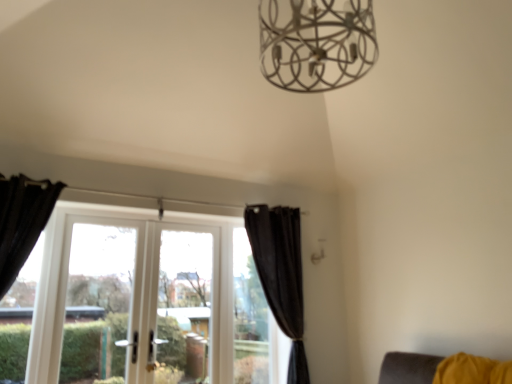
Question: Should I look upward or downward to see white glass screen door at left?

Choices:
 (A) down
 (B) up

Answer: (A)

Question: Does transparent glass window at center, the 1th window in the right-to-left sequence, appear on the right side of black velvet curtain at center, which appears as the 1th curtain when viewed from the back?

Choices:
 (A) no
 (B) yes

Answer: (A)

Question: From a real-world perspective, is transparent glass window at center, placed as the second window when sorted from left to right, under black velvet curtain at center, which ranks as the second curtain in left-to-right order?

Choices:
 (A) no
 (B) yes

Answer: (B)

Question: Is black velvet curtain at center, which is counted as the second curtain, starting from the front, a part of transparent glass window at center, placed as the second window when sorted from left to right?

Choices:
 (A) yes
 (B) no

Answer: (B)

Question: Can you confirm if transparent glass window at center, placed as the second window when sorted from left to right, is positioned to the left of black velvet curtain at center, which ranks as the second curtain in left-to-right order?

Choices:
 (A) yes
 (B) no

Answer: (A)

Question: From a real-world perspective, is transparent glass window at center, the 1th window in the right-to-left sequence, physically above black velvet curtain at center, which ranks as the second curtain in left-to-right order?

Choices:
 (A) yes
 (B) no

Answer: (B)

Question: Is transparent glass window at center, placed as the second window when sorted from left to right, next to black velvet curtain at center, which ranks as the first curtain in right-to-left order?

Choices:
 (A) no
 (B) yes

Answer: (A)

Question: Can you see white glass screen door at left touching transparent glass window at center?

Choices:
 (A) no
 (B) yes

Answer: (A)

Question: From a real-world perspective, is white glass screen door at left positioned under transparent glass window at center based on gravity?

Choices:
 (A) yes
 (B) no

Answer: (B)

Question: Can you confirm if white glass screen door at left is positioned to the left of transparent glass window at center?

Choices:
 (A) no
 (B) yes

Answer: (B)

Question: Does white glass screen door at left have a lesser height compared to transparent glass window at center?

Choices:
 (A) yes
 (B) no

Answer: (A)

Question: From a real-world perspective, does white glass screen door at left stand above transparent glass window at center?

Choices:
 (A) yes
 (B) no

Answer: (A)

Question: Does white glass screen door at left come behind transparent glass window at center?

Choices:
 (A) no
 (B) yes

Answer: (A)

Question: Is transparent glass window at center, placed as the second window when sorted from left to right, turned away from transparent glass window at center?

Choices:
 (A) no
 (B) yes

Answer: (A)